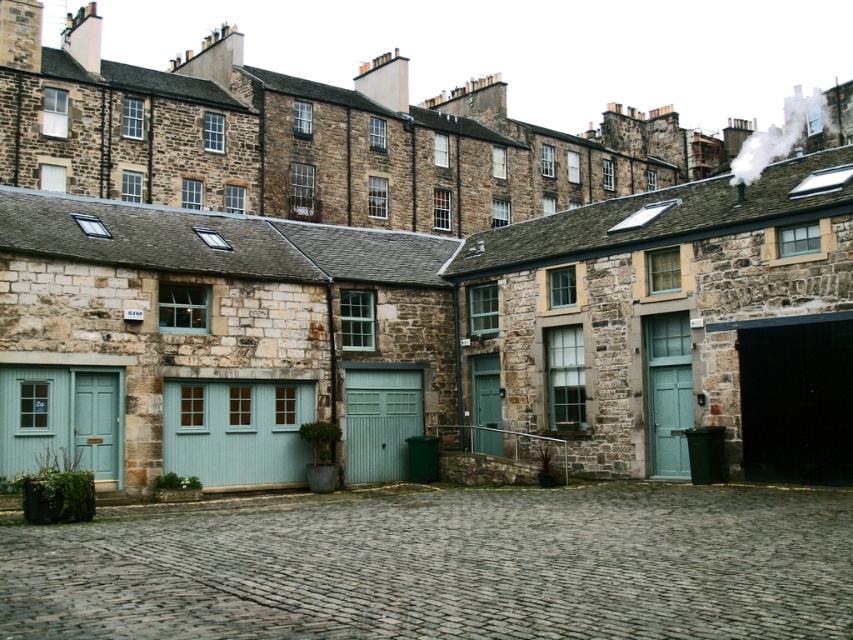
Question: Considering the real-world distances, which object is closest to the green corrugated metal garage door at center?

Choices:
 (A) cobblestone at center
 (B) teal painted wood garage door at lower left
 (C) light blue wooden garage door at center

Answer: (C)

Question: Among these points, which one is nearest to the camera?

Choices:
 (A) (282, 528)
 (B) (352, 451)

Answer: (A)

Question: Is teal painted wood garage door at lower left below green corrugated metal garage door at center?

Choices:
 (A) no
 (B) yes

Answer: (B)

Question: Is teal painted wood garage door at lower left to the left of green corrugated metal garage door at center from the viewer's perspective?

Choices:
 (A) yes
 (B) no

Answer: (A)

Question: Which of the following is the farthest from the observer?

Choices:
 (A) cobblestone at center
 (B) green corrugated metal garage door at center
 (C) light blue wooden garage door at center

Answer: (B)

Question: Considering the relative positions of cobblestone at center and light blue wooden garage door at center in the image provided, where is cobblestone at center located with respect to light blue wooden garage door at center?

Choices:
 (A) right
 (B) left

Answer: (A)